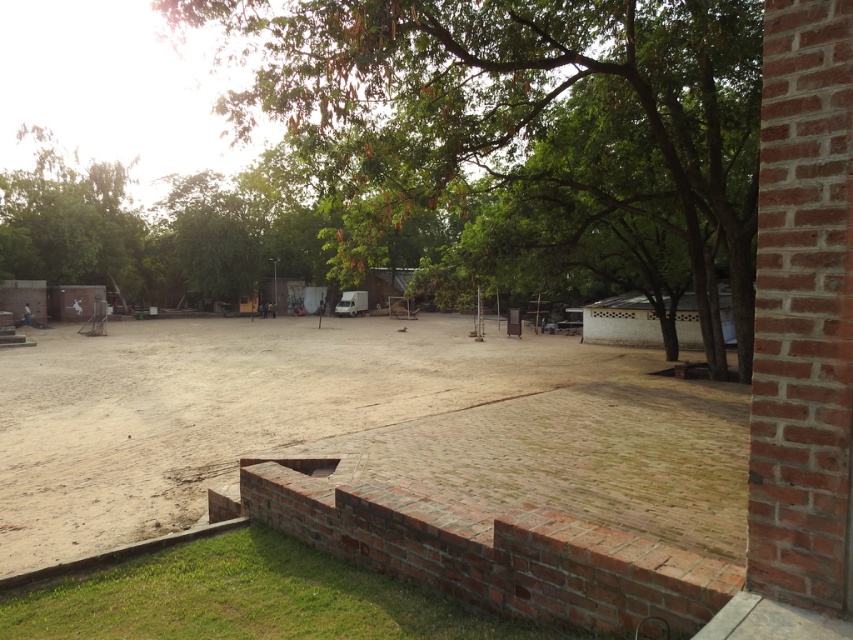
Question: Is green leafy tree at center positioned behind brown dirt field at center?

Choices:
 (A) yes
 (B) no

Answer: (A)

Question: Which point is closer to the camera taking this photo?

Choices:
 (A) (194, 397)
 (B) (376, 188)

Answer: (A)

Question: Is green leafy tree at center to the right of brown dirt field at center from the viewer's perspective?

Choices:
 (A) no
 (B) yes

Answer: (B)

Question: Which of the following is the closest to the observer?

Choices:
 (A) (566, 179)
 (B) (503, 394)

Answer: (B)

Question: Is green leafy tree at center wider than brown dirt field at center?

Choices:
 (A) yes
 (B) no

Answer: (B)

Question: Which point appears closest to the camera in this image?

Choices:
 (A) (293, 132)
 (B) (39, 364)

Answer: (A)